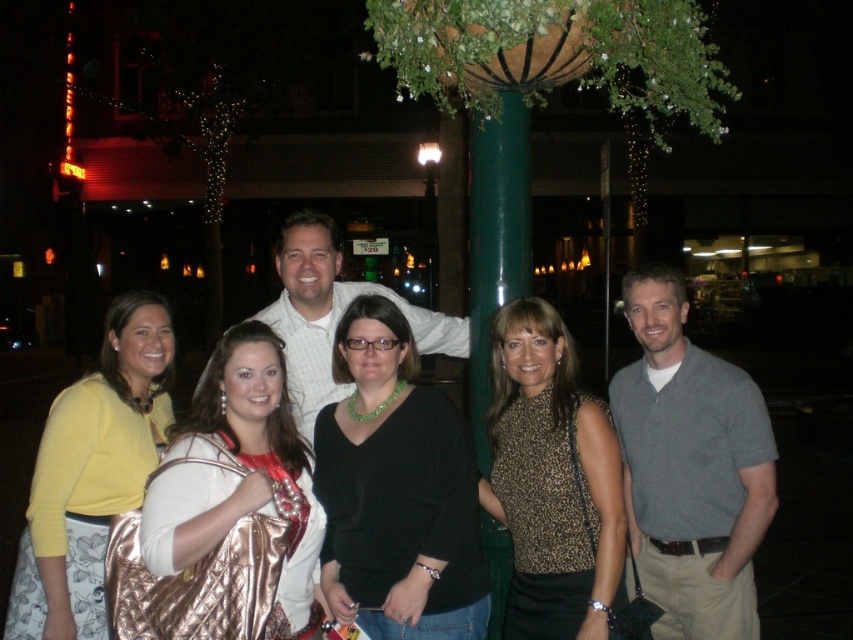
You are a photographer trying to capture a closeup of the metallic gold purse at center. Based on its position coordinates, where should you aim your camera?

The metallic gold purse at center is located at coordinates point [241,477], so aim your camera there to capture it.

In the scene shown: You are a photographer trying to capture a group photo where the leopard print top at center and the metallic gold lamp post at center are both in focus. Based on their positions, which object should you ensure is closer to the camera to achieve better focus on both?

The leopard print top at center is positioned on the right side of metallic gold lamp post at center. To have both in focus, the metallic gold lamp post at center should be closer to the camera since the leopard print top at center is to its right, requiring the photographer to adjust focus accordingly.